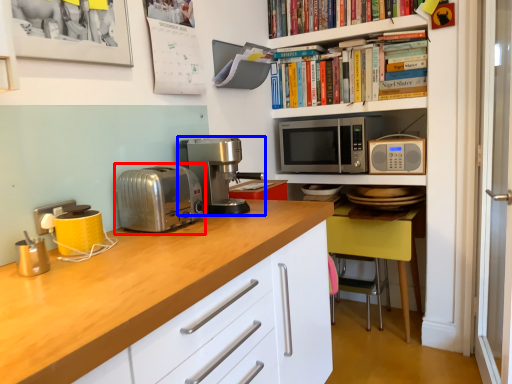
Question: Which point is closer to the camera, toaster (highlighted by a red box) or coffee machine (highlighted by a blue box)?

Choices:
 (A) toaster
 (B) coffee machine

Answer: (A)